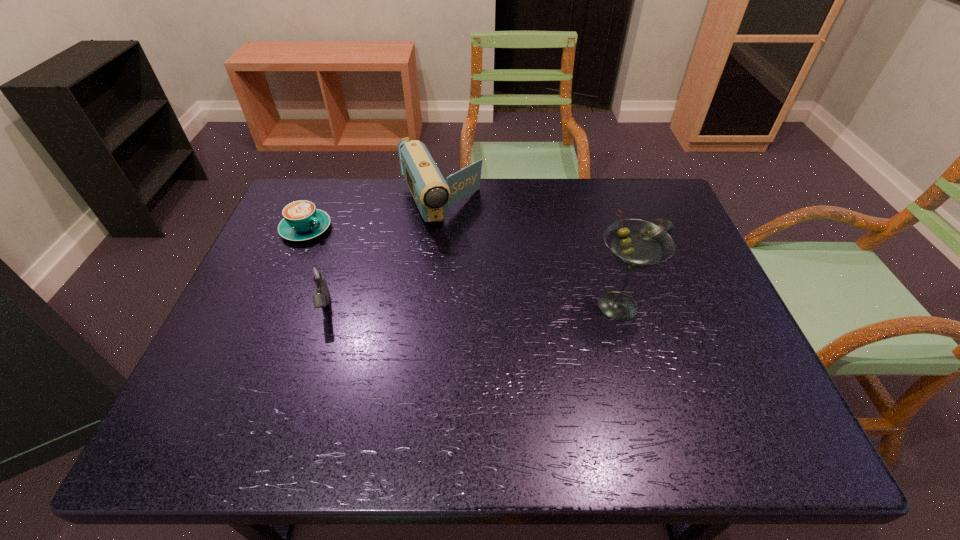
The image size is (960, 540). What are the coordinates of `vacant space located 0.160m with the handle on the right side of the leftmost object` in the screenshot? It's located at (367, 258).

Find the location of a particular element. This screenshot has height=540, width=960. computer mouse present at the far edge is located at coordinates (667, 225).

The image size is (960, 540). Find the location of `camcorder that is at the far edge`. camcorder that is at the far edge is located at coordinates (433, 195).

Identify the location of cappuccino positioned at the far edge. The width and height of the screenshot is (960, 540). (302, 221).

What are the coordinates of `object that is at the left edge` in the screenshot? It's located at (302, 221).

Identify the location of object positioned at the right edge. Image resolution: width=960 pixels, height=540 pixels. (667, 225).

The image size is (960, 540). I want to click on object that is at the far left corner, so click(302, 221).

Identify the location of object that is positioned at the far right corner. The image size is (960, 540). coord(667,225).

Where is `vacant space at the far edge of the desktop`? This screenshot has width=960, height=540. vacant space at the far edge of the desktop is located at coordinates (523, 208).

This screenshot has width=960, height=540. Find the location of `vacant space at the near edge of the desktop`. vacant space at the near edge of the desktop is located at coordinates (415, 393).